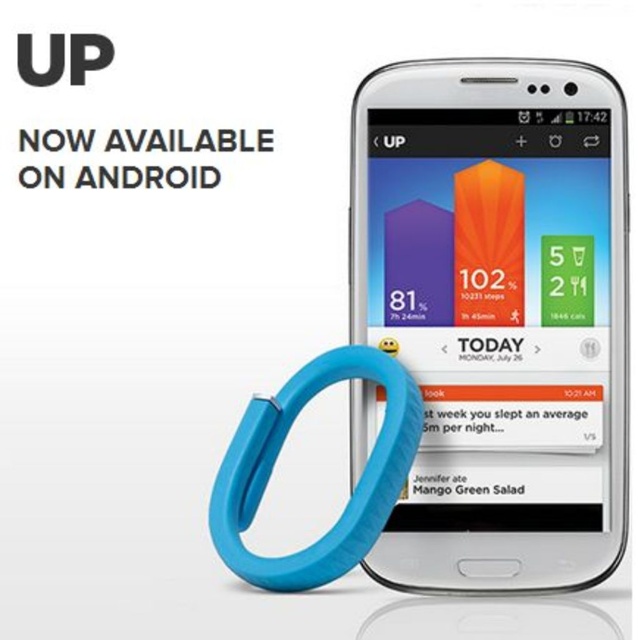
Question: Is white glossy smartphone at center bigger than blue rubber band at lower left?

Choices:
 (A) yes
 (B) no

Answer: (A)

Question: Does white glossy smartphone at center appear under blue rubber band at lower left?

Choices:
 (A) yes
 (B) no

Answer: (B)

Question: Which object is closer to the camera taking this photo?

Choices:
 (A) blue rubber band at lower left
 (B) white glossy smartphone at center

Answer: (A)

Question: Which object appears farthest from the camera in this image?

Choices:
 (A) blue rubber band at lower left
 (B) white glossy smartphone at center

Answer: (B)

Question: Is white glossy smartphone at center below blue rubber band at lower left?

Choices:
 (A) no
 (B) yes

Answer: (A)

Question: Among these points, which one is farthest from the camera?

Choices:
 (A) pos(258,397)
 (B) pos(491,250)

Answer: (B)